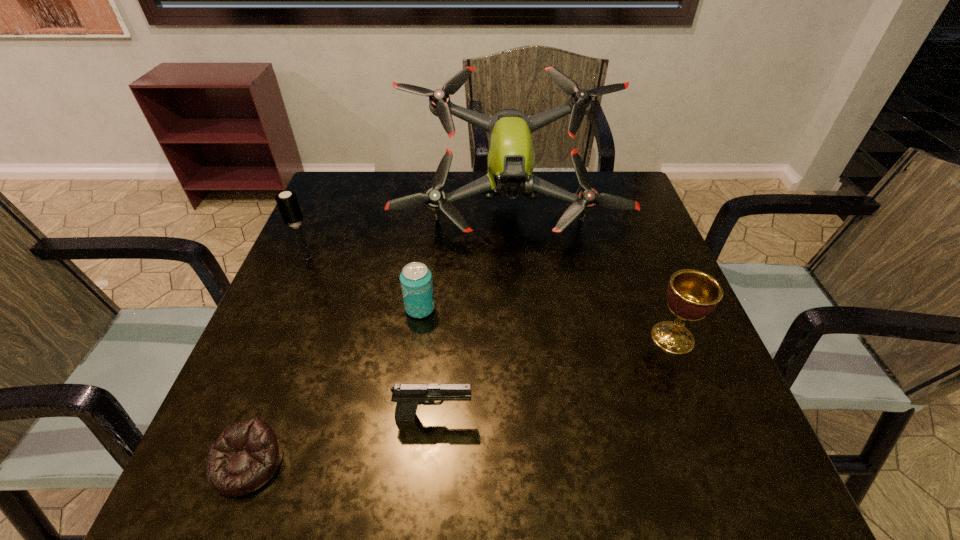
Identify which object is located as the fourth nearest to the nearest object. Please provide its 2D coordinates. Your answer should be formatted as a tuple, i.e. [(x, y)], where the tuple contains the x and y coordinates of a point satisfying the conditions above.

[(511, 159)]

Find the location of a particular element. The height and width of the screenshot is (540, 960). object that ranks as the closest to the nearest object is located at coordinates (408, 396).

This screenshot has height=540, width=960. Find the location of `free space in the image that satisfies the following two spatial constraints: 1. on the front-facing side of the third tallest object; 2. on the left side of the drone`. free space in the image that satisfies the following two spatial constraints: 1. on the front-facing side of the third tallest object; 2. on the left side of the drone is located at coordinates pos(518,338).